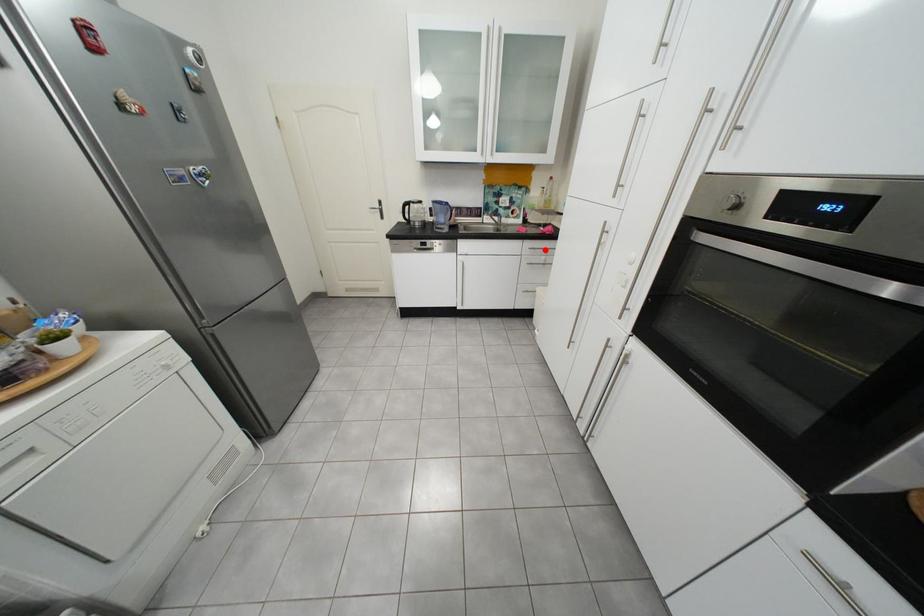
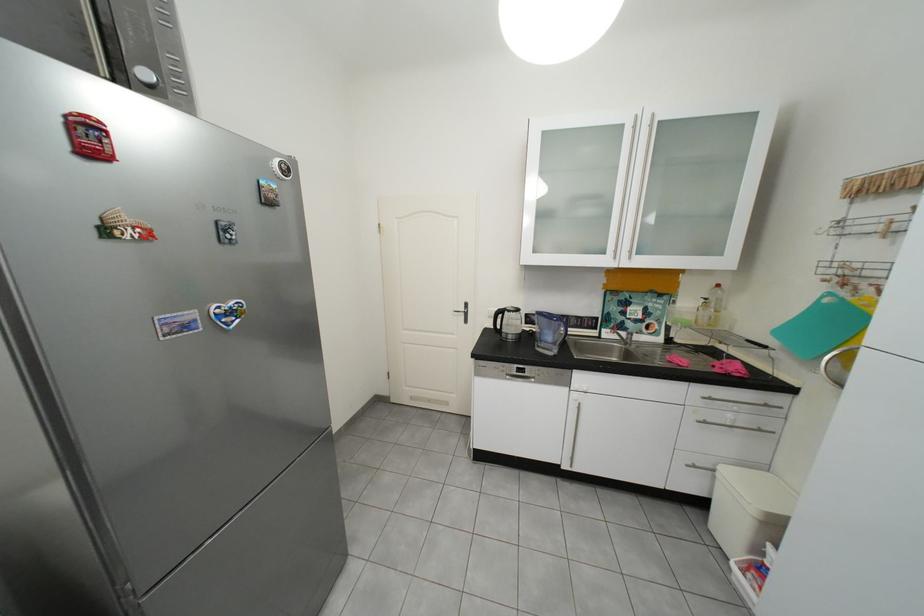
The point at the highlighted location is marked in the first image. Where is the corresponding point in the second image?

(723, 400)